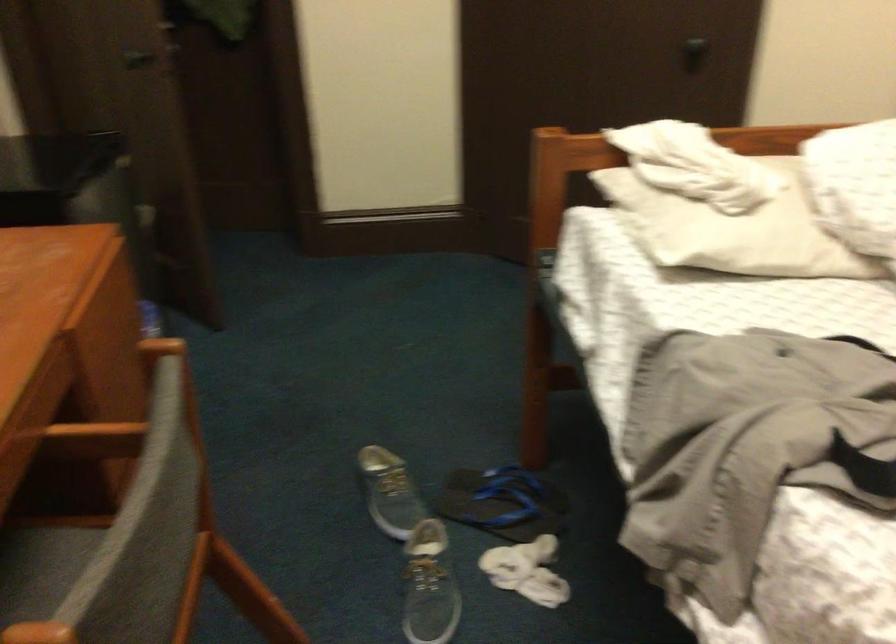
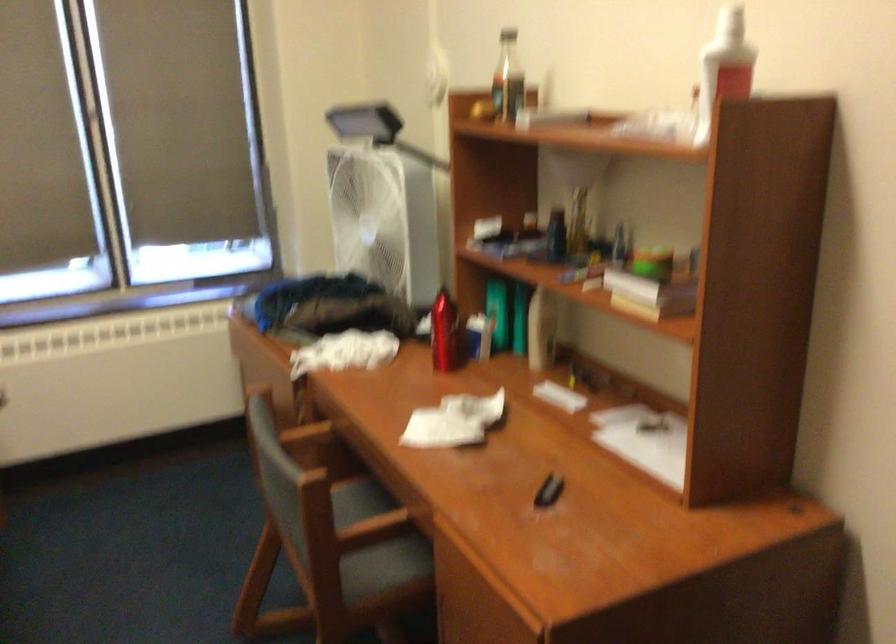
Where in the second image is the point corresponding to [109,451] from the first image?

(375, 545)